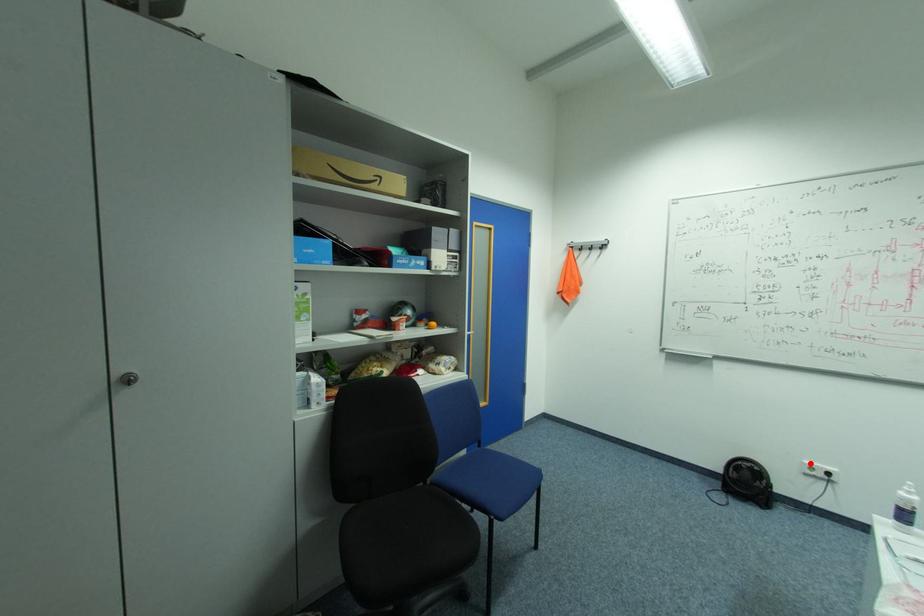
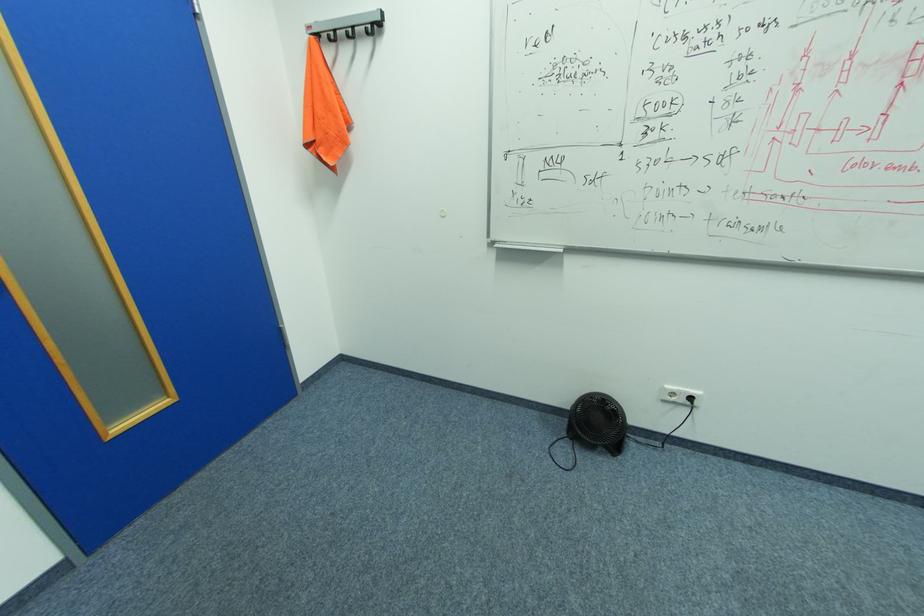
Question: A red point is marked in image1. In image2, is the corresponding 3D point closer to the camera or farther? Reply with the corresponding letter.

Choices:
 (A) The corresponding 3D point is closer.
 (B) The corresponding 3D point is farther.

Answer: (A)